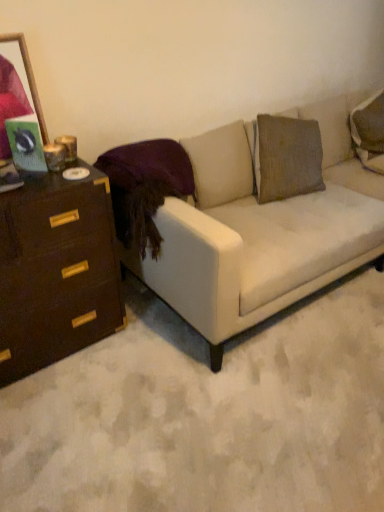
Question: Can you confirm if wooden picture frame at upper left is wider than dark brown wood chest of drawers at left?

Choices:
 (A) yes
 (B) no

Answer: (B)

Question: Is wooden picture frame at upper left looking in the opposite direction of dark brown wood chest of drawers at left?

Choices:
 (A) yes
 (B) no

Answer: (B)

Question: Considering the relative positions of wooden picture frame at upper left and dark brown wood chest of drawers at left in the image provided, is wooden picture frame at upper left behind dark brown wood chest of drawers at left?

Choices:
 (A) yes
 (B) no

Answer: (A)

Question: Is wooden picture frame at upper left placed right next to dark brown wood chest of drawers at left?

Choices:
 (A) no
 (B) yes

Answer: (A)

Question: From the image's perspective, is wooden picture frame at upper left located above dark brown wood chest of drawers at left?

Choices:
 (A) no
 (B) yes

Answer: (B)

Question: Would you say dark brown wood chest of drawers at left is part of wooden picture frame at upper left's contents?

Choices:
 (A) yes
 (B) no

Answer: (B)

Question: From the image's perspective, is dark brown wood chest of drawers at left located beneath wooden picture frame at upper left?

Choices:
 (A) yes
 (B) no

Answer: (A)

Question: Does dark brown wood chest of drawers at left have a greater width compared to wooden picture frame at upper left?

Choices:
 (A) no
 (B) yes

Answer: (B)

Question: Can you confirm if dark brown wood chest of drawers at left is shorter than wooden picture frame at upper left?

Choices:
 (A) no
 (B) yes

Answer: (A)

Question: Is wooden picture frame at upper left at the back of dark brown wood chest of drawers at left?

Choices:
 (A) no
 (B) yes

Answer: (A)

Question: Is dark brown wood chest of drawers at left next to wooden picture frame at upper left?

Choices:
 (A) yes
 (B) no

Answer: (B)

Question: Is the position of dark brown wood chest of drawers at left more distant than that of wooden picture frame at upper left?

Choices:
 (A) no
 (B) yes

Answer: (A)

Question: From the image's perspective, is velvet purple pillow at upper left on white fabric couch at center?

Choices:
 (A) yes
 (B) no

Answer: (A)